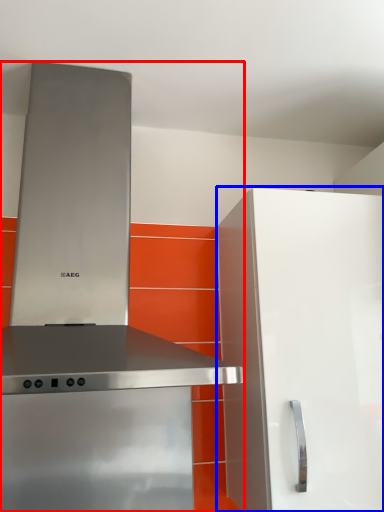
Question: Which object is further to the camera taking this photo, home appliance (highlighted by a red box) or cabinetry (highlighted by a blue box)?

Choices:
 (A) home appliance
 (B) cabinetry

Answer: (B)